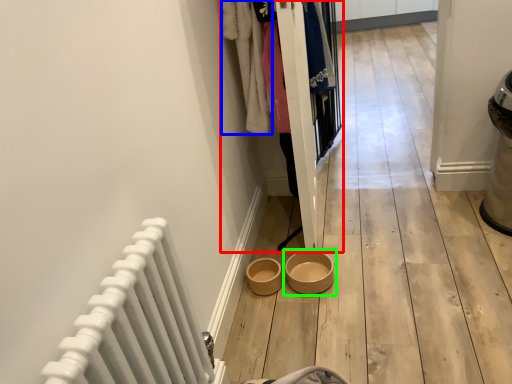
Question: Considering the real-world distances, which object is closest to closet (highlighted by a red box)? clothing (highlighted by a blue box) or bowl (highlighted by a green box).

Choices:
 (A) clothing
 (B) bowl

Answer: (A)